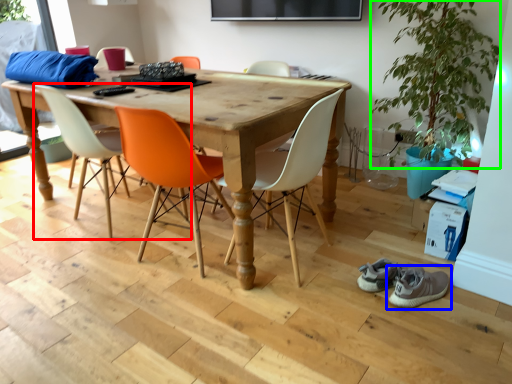
Question: Based on their relative distances, which object is nearer to chair (highlighted by a red box)? Choose from footwear (highlighted by a blue box) and plant (highlighted by a green box).

Choices:
 (A) footwear
 (B) plant

Answer: (A)